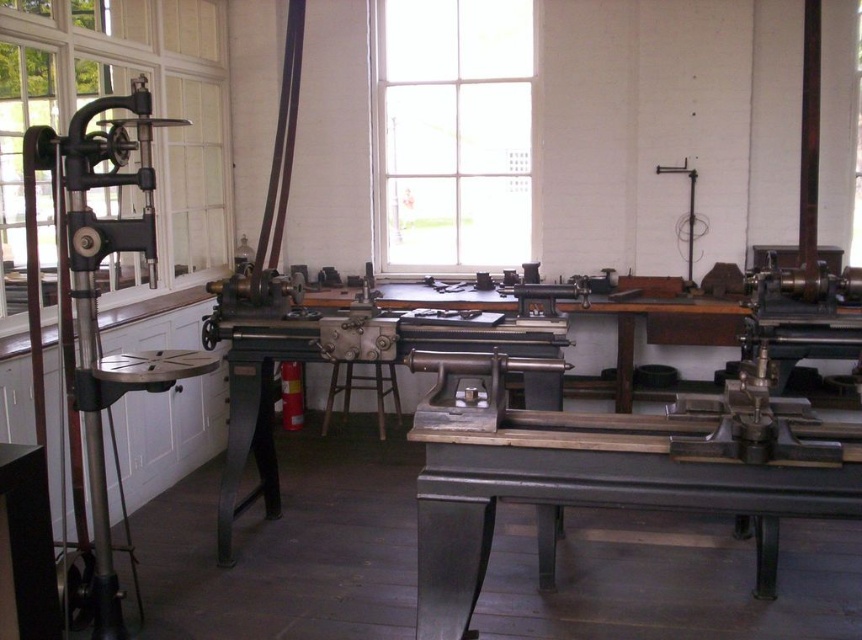
You are a mechanic working in the workshop and need to place a heavy tool on the metallic gray table at center. However, you notice the clear glass window at left is above the table. Will the window obstruct placing the tool on the table?

The clear glass window at left is positioned over the metallic gray table at center, so placing the tool there may be obstructed by the window.

You are standing in the workshop and want to see outside through the clear glass window at left while also needing to use the polished metal vise at left. Which object is closer to your left side?

The clear glass window at left is positioned on the left side of the polished metal vise at left, so the clear glass window at left is closer to your left side.

You are a maintenance technician standing in front of the clear glass window at left in the workshop. Your supervisor has asked you to reach a tool that is placed on a shelf 3 meters away from you. Can you safely reach the tool without moving your position?

The clear glass window at left is 3.13 meters away from the camera, so the tool on the shelf 3 meters away is within reach. You can safely reach the tool without moving your position.